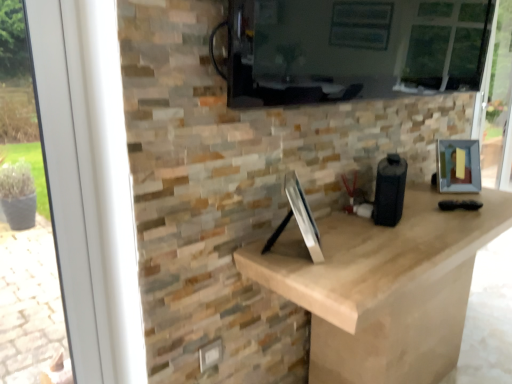
Question: In terms of size, does matte black screen at upper center appear bigger or smaller than metallic silver picture frame at right?

Choices:
 (A) big
 (B) small

Answer: (A)

Question: From a real-world perspective, is matte black screen at upper center positioned above or below metallic silver picture frame at right?

Choices:
 (A) above
 (B) below

Answer: (A)

Question: Considering the real-world distances, which object is closest to the matte black screen at upper center?

Choices:
 (A) metallic silver picture frame at right
 (B) white plastic window frame at left

Answer: (A)

Question: Which object is the closest to the metallic silver picture frame at right?

Choices:
 (A) white plastic window frame at left
 (B) matte black screen at upper center

Answer: (B)